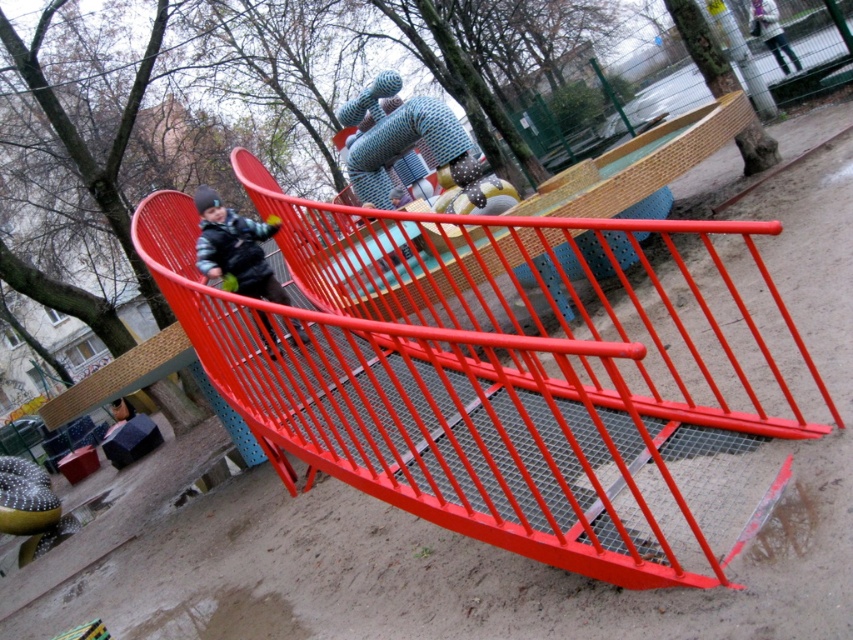
A child is standing at the base of the metallic red slide at center and wants to toss a small yellow ball to their friend wearing the matte black jacket at left. If the child can throw the ball 1.5 meters, will they be able to reach their friend?

The distance between the metallic red slide at center and the matte black jacket at left is 1.51 meters. Since the child can only throw 1.5 meters, they will not be able to reach their friend.

You are a parent supervising children at the playground. You see the metallic red slide at center and the matte black jacket at left. Which object is positioned to the right of the other?

The metallic red slide at center is to the right of the matte black jacket at left.

You are a parent watching your child play in the playground. You see the metallic red slide at center and the matte black jacket at left. Which object is closer to the ground?

The metallic red slide at center is closer to the ground because it is located below the matte black jacket at left.